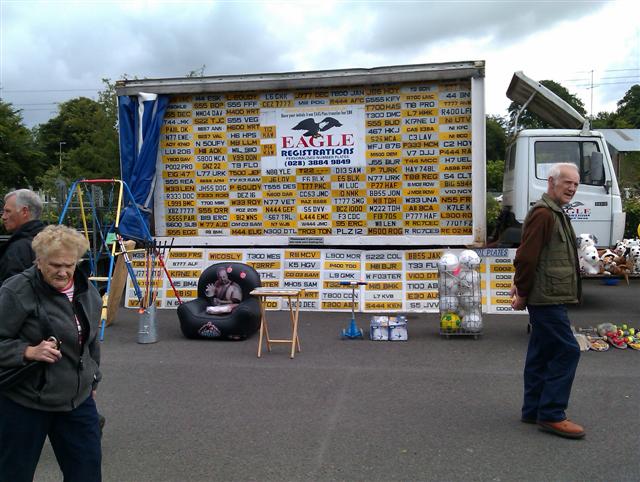
This screenshot has height=482, width=640. In order to click on chair in this screenshot , I will do `click(224, 290)`.